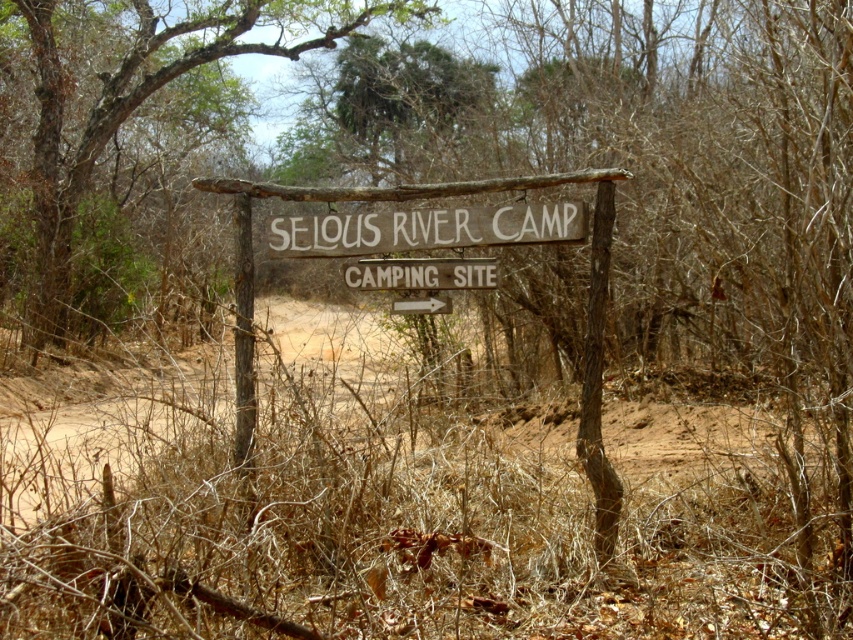
Who is positioned more to the left, brown sandy dirt at center or brown wood sign at center?

Positioned to the left is brown wood sign at center.

Can you confirm if brown sandy dirt at center is wider than brown wood sign at center?

Indeed, brown sandy dirt at center has a greater width compared to brown wood sign at center.

Between point (653, 448) and point (177, 36), which one is positioned behind?

The point (177, 36) is more distant.

This screenshot has width=853, height=640. What are the coordinates of `brown sandy dirt at center` in the screenshot? It's located at (102, 426).

Is brown sandy dirt at center closer to camera compared to brown wooden sign at center?

Yes, brown sandy dirt at center is in front of brown wooden sign at center.

Does point (751, 442) lie in front of point (424, 284)?

No, it is behind (424, 284).

In order to click on brown sandy dirt at center in this screenshot , I will do `click(102, 426)`.

Does brown sandy dirt at center appear on the left side of wooden signboard at center?

Indeed, brown sandy dirt at center is positioned on the left side of wooden signboard at center.

Can you confirm if brown sandy dirt at center is positioned below wooden signboard at center?

Yes.

Describe the element at coordinates (102, 426) in the screenshot. I see `brown sandy dirt at center` at that location.

Find the location of a particular element. The height and width of the screenshot is (640, 853). brown sandy dirt at center is located at coordinates (102, 426).